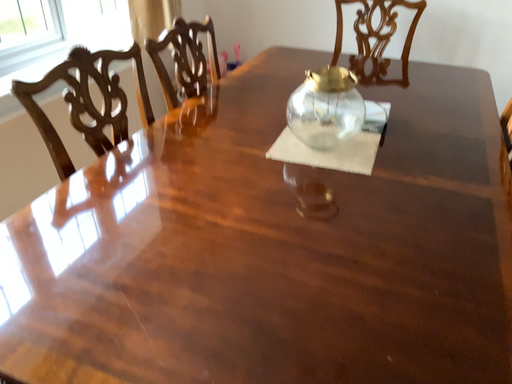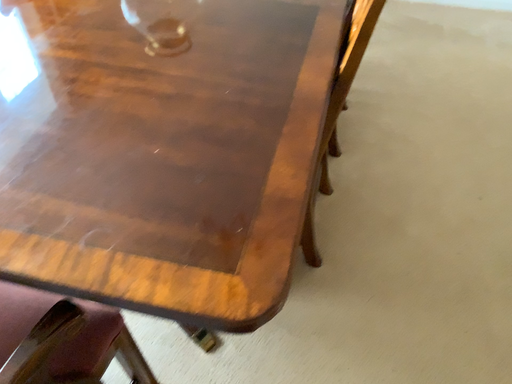
Question: Which way did the camera rotate in the video?

Choices:
 (A) rotated upward
 (B) rotated downward

Answer: (B)